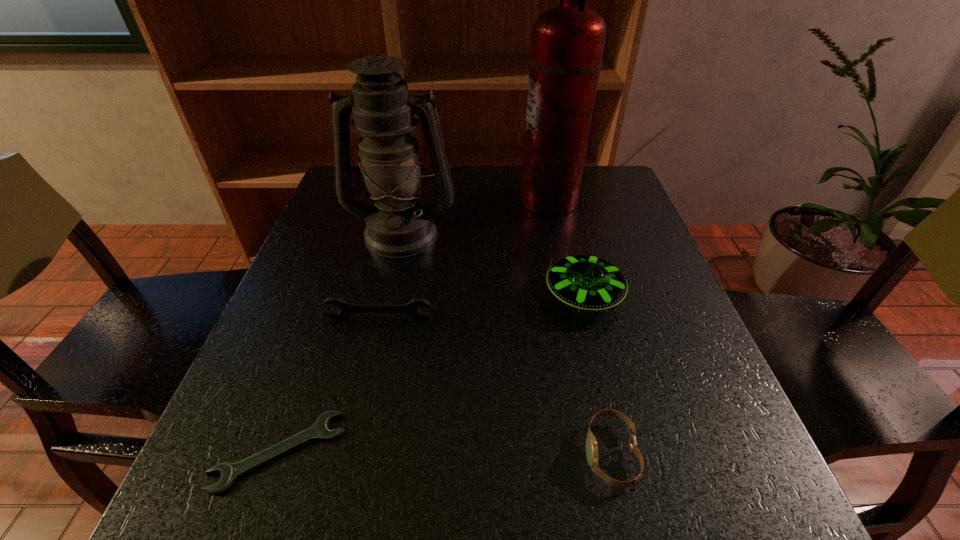
You are a GUI agent. You are given a task and a screenshot of the screen. Output one action in this format:
    pyautogui.click(x=<x>, y=<y>)
    Task: Click on the free space between the nearer wrench and the saucer
    
    Given the screenshot: What is the action you would take?
    pyautogui.click(x=431, y=374)

Identify the location of empty space that is in between the tallest object and the fifth shortest object. (475, 217).

Choose which object is the third nearest neighbor to the taller wrench. Please provide its 2D coordinates. Your answer should be formatted as a tuple, i.e. [(x, y)], where the tuple contains the x and y coordinates of a point satisfying the conditions above.

[(585, 282)]

Locate an element on the screen. This screenshot has height=540, width=960. object that is the fifth closest one to the watch is located at coordinates (567, 44).

This screenshot has height=540, width=960. What are the coordinates of `free spot that satisfies the following two spatial constraints: 1. on the side of the tallest object with the handle and hose; 2. on the right side of the saucer` in the screenshot? It's located at (569, 295).

At what (x,y) coordinates should I click in order to perform the action: click on blank space that satisfies the following two spatial constraints: 1. on the front side of the third tallest object; 2. on the face of the watch. Please return your answer as a coordinate pair (x, y). Looking at the image, I should click on (623, 454).

Image resolution: width=960 pixels, height=540 pixels. I want to click on vacant space that satisfies the following two spatial constraints: 1. on the back side of the fifth shortest object; 2. on the left side of the shorter wrench, so click(356, 233).